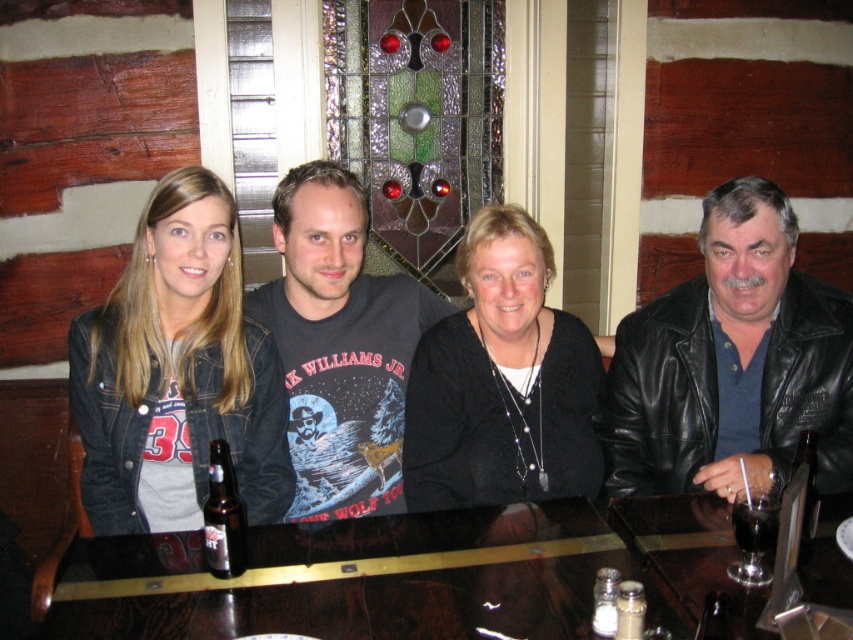
Is shiny dark wood table at center to the left of black matte sweater at center from the viewer's perspective?

Indeed, shiny dark wood table at center is positioned on the left side of black matte sweater at center.

From the picture: Can you confirm if shiny dark wood table at center is shorter than black matte sweater at center?

Indeed, shiny dark wood table at center has a lesser height compared to black matte sweater at center.

Is point (277, 579) farther from camera compared to point (427, 452)?

No, (277, 579) is closer to viewer.

You are a GUI agent. You are given a task and a screenshot of the screen. Output one action in this format:
    pyautogui.click(x=<x>, y=<y>)
    Task: Click on the shiny dark wood table at center
    
    Given the screenshot: What is the action you would take?
    pyautogui.click(x=384, y=579)

Is point (671, 364) behind point (495, 356)?

That is True.

Where is `black leather jacket at right`? This screenshot has height=640, width=853. black leather jacket at right is located at coordinates (730, 362).

Does shiny dark wood table at center have a larger size compared to dark gray t-shirt at center?

No, shiny dark wood table at center is not bigger than dark gray t-shirt at center.

Who is more distant from viewer, (286, 563) or (357, 196)?

Point (357, 196)

Find the location of a particular element. shiny dark wood table at center is located at coordinates (384, 579).